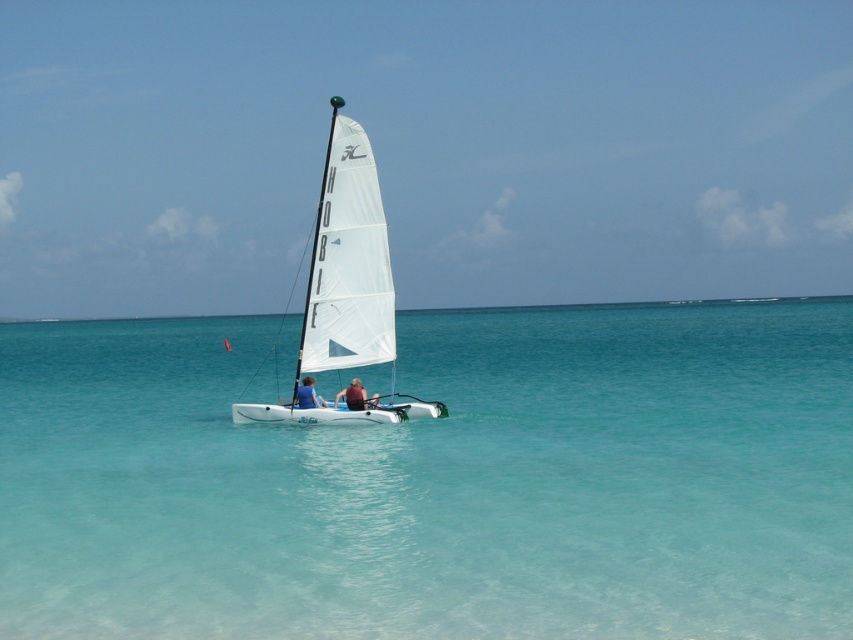
From the picture: Is matte blue sailboat at center smaller than blue fabric sailboat at center?

No, matte blue sailboat at center is not smaller than blue fabric sailboat at center.

Image resolution: width=853 pixels, height=640 pixels. In order to click on matte blue sailboat at center in this screenshot , I will do `click(357, 396)`.

Who is more forward, (363, 406) or (321, 403)?

Point (363, 406)

Find the location of a particular element. matte blue sailboat at center is located at coordinates (357, 396).

Which is in front, point (463, 545) or point (305, 396)?

Positioned in front is point (463, 545).

Between point (281, 593) and point (296, 390), which one is positioned behind?

Positioned behind is point (296, 390).

Measure the distance between point (310, 522) and camera.

Point (310, 522) is 11.33 meters away from camera.

You are a GUI agent. You are given a task and a screenshot of the screen. Output one action in this format:
    pyautogui.click(x=<x>, y=<y>)
    Task: Click on the clear blue water at center
    
    Given the screenshot: What is the action you would take?
    pyautogui.click(x=438, y=481)

Is white matte sailboat at center closer to camera compared to matte blue sailboat at center?

Yes, it is in front of matte blue sailboat at center.

Does white matte sailboat at center have a larger size compared to matte blue sailboat at center?

Yes.

Between point (357, 296) and point (352, 406), which one is positioned in front?

Point (352, 406) is in front.

I want to click on white matte sailboat at center, so click(x=345, y=289).